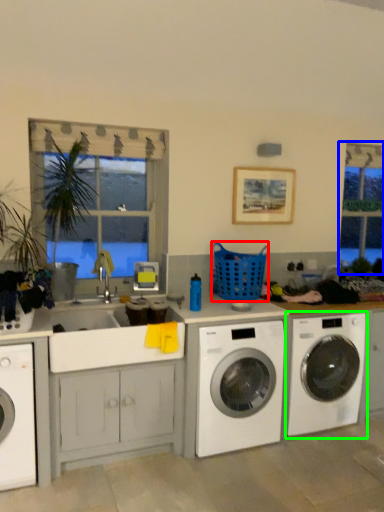
Question: Based on their relative distances, which object is nearer to basket (highlighted by a red box)? Choose from bay window (highlighted by a blue box) and washing machine (highlighted by a green box).

Choices:
 (A) bay window
 (B) washing machine

Answer: (B)